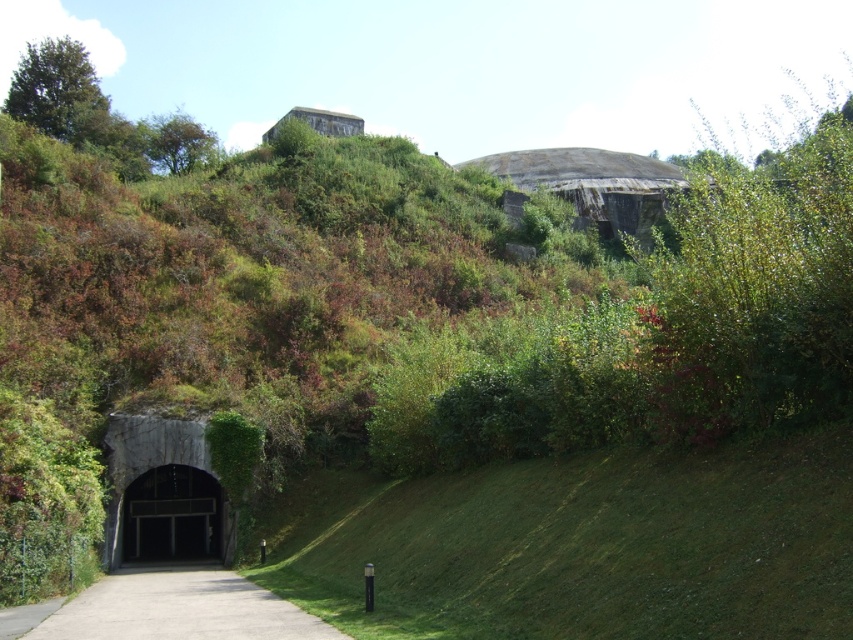
Consider the image. Is concrete at center shorter than black concrete tunnel at lower left?

Indeed, concrete at center has a lesser height compared to black concrete tunnel at lower left.

Is point (132, 630) positioned in front of point (151, 556)?

Yes, it is.

Find the location of a particular element. This screenshot has width=853, height=640. concrete at center is located at coordinates (180, 609).

Who is higher up, gray concrete bunker at lower left or black concrete tunnel at lower left?

gray concrete bunker at lower left is higher up.

Is gray concrete bunker at lower left wider than black concrete tunnel at lower left?

Yes, gray concrete bunker at lower left is wider than black concrete tunnel at lower left.

Where is `gray concrete bunker at lower left`? The width and height of the screenshot is (853, 640). gray concrete bunker at lower left is located at coordinates (177, 484).

In the scene shown: Is gray concrete bunker at lower left below concrete at center?

Correct, gray concrete bunker at lower left is located below concrete at center.

Does gray concrete bunker at lower left appear on the right side of concrete at center?

In fact, gray concrete bunker at lower left is to the left of concrete at center.

This screenshot has width=853, height=640. I want to click on gray concrete bunker at lower left, so click(x=177, y=484).